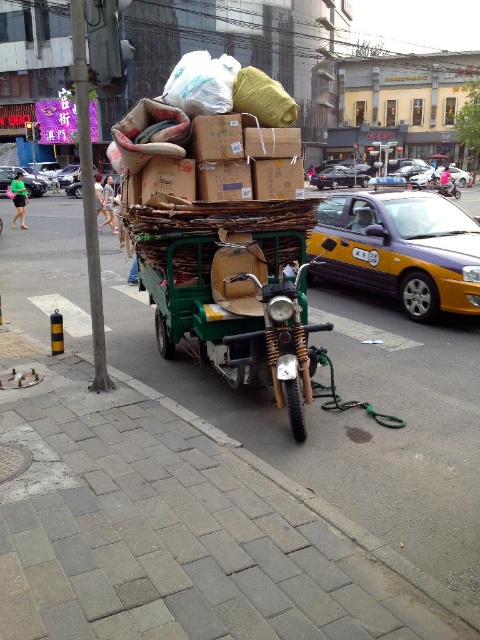
You are a pedestrian standing at the crosswalk. There is a yellow metallic taxi at center right and a metallic silver motorcycle at center. If you want to cross the street safely, which vehicle should you wait for to pass first, the one closer to you or the farther one? Please explain based on their positions.

The yellow metallic taxi at center right is farther from you than the metallic silver motorcycle at center since they are 84.15 feet apart. You should wait for the closer vehicle, the metallic silver motorcycle at center, to pass first before crossing.

From the picture: You are a pedestrian standing on the sidewalk. You see a shiny black sedan at center and a metallic silver motorcycle at center. Which one is positioned to the left?

The shiny black sedan at center is to the left of the metallic silver motorcycle at center.